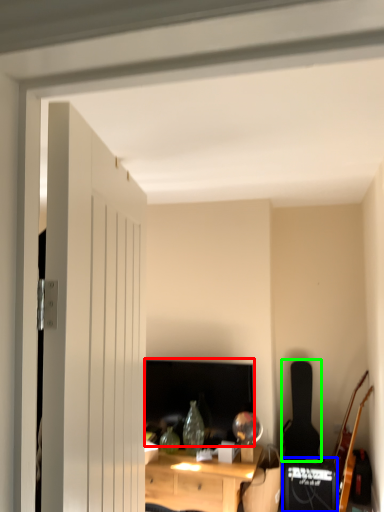
Question: Considering the real-world distances, which object is farthest from computer monitor (highlighted by a red box)? speaker (highlighted by a blue box) or guitar (highlighted by a green box)?

Choices:
 (A) speaker
 (B) guitar

Answer: (B)